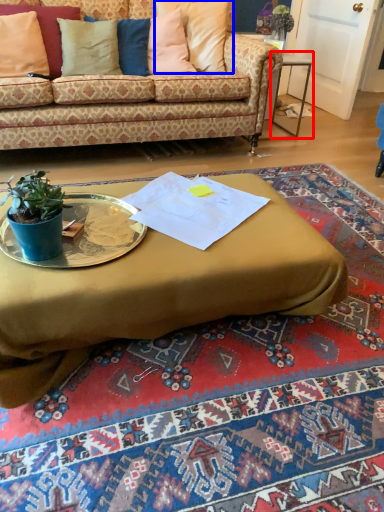
Question: Which object appears farthest to the camera in this image, table (highlighted by a red box) or pillow (highlighted by a blue box)?

Choices:
 (A) table
 (B) pillow

Answer: (A)